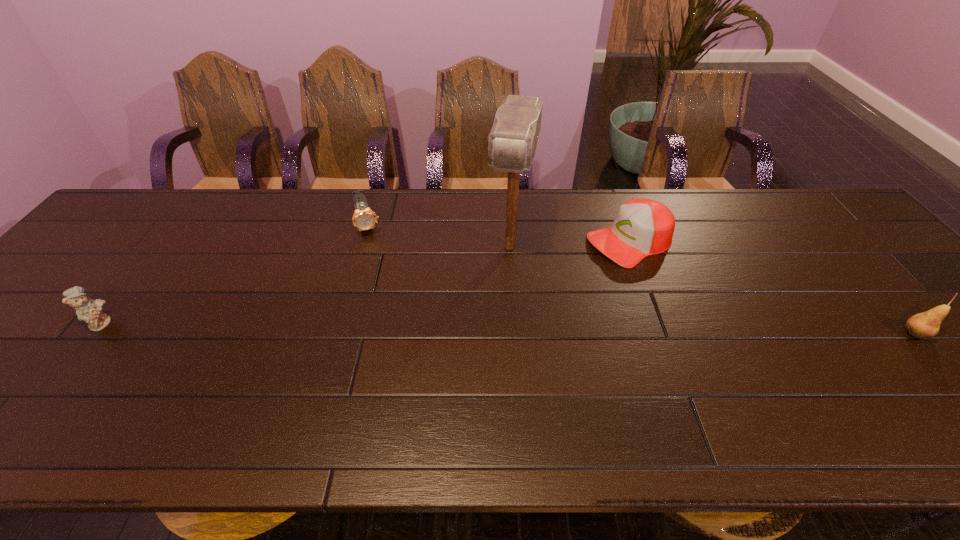
Find the location of a particular element. Image resolution: width=960 pixels, height=540 pixels. the leftmost object is located at coordinates (88, 310).

Where is `pear`? This screenshot has height=540, width=960. pear is located at coordinates (925, 325).

Find the location of `the third object from right to left`. the third object from right to left is located at coordinates (513, 139).

I want to click on the tallest object, so click(x=513, y=139).

In order to click on watch in this screenshot , I will do `click(364, 218)`.

You are a GUI agent. You are given a task and a screenshot of the screen. Output one action in this format:
    pyautogui.click(x=<x>, y=<y>)
    Task: Click on the second object from right to left
    The height and width of the screenshot is (540, 960).
    Given the screenshot: What is the action you would take?
    pyautogui.click(x=642, y=227)

This screenshot has height=540, width=960. In order to click on vacant position located 0.100m on the front-facing side of the teddy bear in this screenshot , I will do `click(154, 322)`.

I want to click on free location located 0.260m on the left of the rightmost object, so click(790, 334).

Find the location of `free location located above the head of the mallet`. free location located above the head of the mallet is located at coordinates (501, 294).

This screenshot has height=540, width=960. I want to click on free point located 0.050m above the head of the mallet, so click(503, 286).